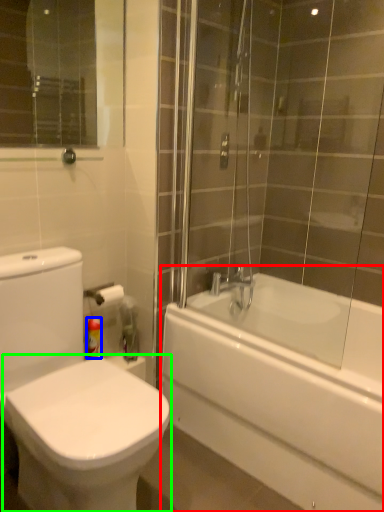
Question: Based on their relative distances, which object is farther from bathtub (highlighted by a red box)? Choose from toiletry (highlighted by a blue box) and bidet (highlighted by a green box).

Choices:
 (A) toiletry
 (B) bidet

Answer: (A)